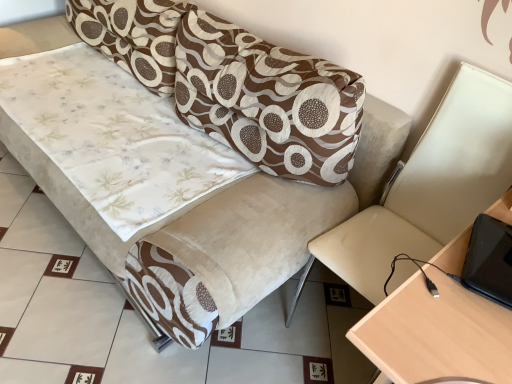
Question: From a real-world perspective, is beige leather swivel chair at right positioned under velvet-like beige couch at center based on gravity?

Choices:
 (A) yes
 (B) no

Answer: (B)

Question: Is beige leather swivel chair at right facing towards velvet-like beige couch at center?

Choices:
 (A) no
 (B) yes

Answer: (A)

Question: Considering the relative sizes of beige leather swivel chair at right and velvet-like beige couch at center in the image provided, is beige leather swivel chair at right thinner than velvet-like beige couch at center?

Choices:
 (A) no
 (B) yes

Answer: (B)

Question: From the image's perspective, is beige leather swivel chair at right on velvet-like beige couch at center?

Choices:
 (A) yes
 (B) no

Answer: (B)

Question: Is the position of beige leather swivel chair at right less distant than that of velvet-like beige couch at center?

Choices:
 (A) yes
 (B) no

Answer: (A)

Question: Is beige leather swivel chair at right not inside velvet-like beige couch at center?

Choices:
 (A) yes
 (B) no

Answer: (A)

Question: Considering the relative sizes of light wood table at right and beige leather swivel chair at right in the image provided, is light wood table at right smaller than beige leather swivel chair at right?

Choices:
 (A) no
 (B) yes

Answer: (A)

Question: From the image's perspective, is light wood table at right below beige leather swivel chair at right?

Choices:
 (A) yes
 (B) no

Answer: (A)

Question: Considering the relative sizes of light wood table at right and beige leather swivel chair at right in the image provided, is light wood table at right bigger than beige leather swivel chair at right?

Choices:
 (A) no
 (B) yes

Answer: (B)

Question: Can you confirm if light wood table at right is positioned to the right of beige leather swivel chair at right?

Choices:
 (A) no
 (B) yes

Answer: (B)

Question: Is light wood table at right positioned beyond the bounds of beige leather swivel chair at right?

Choices:
 (A) yes
 (B) no

Answer: (A)

Question: Does light wood table at right have a lesser width compared to beige leather swivel chair at right?

Choices:
 (A) yes
 (B) no

Answer: (B)

Question: Is beige leather swivel chair at right bigger than brown textured pillow at upper center?

Choices:
 (A) no
 (B) yes

Answer: (B)